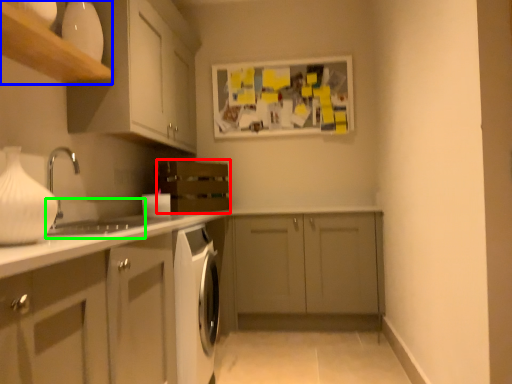
Question: Which object is the closest to the oven (highlighted by a red box)? Choose among these: shelf (highlighted by a blue box) or sink (highlighted by a green box).

Choices:
 (A) shelf
 (B) sink

Answer: (B)